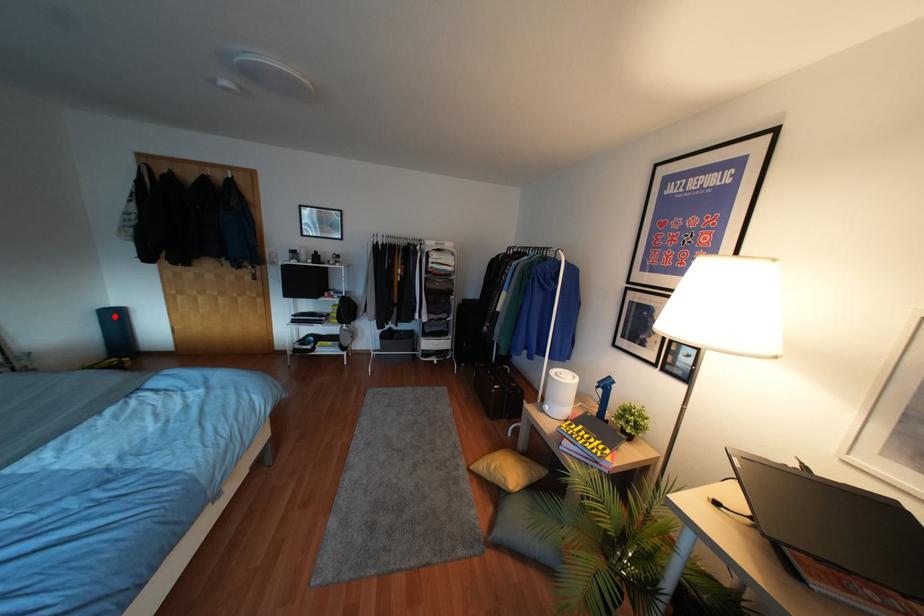
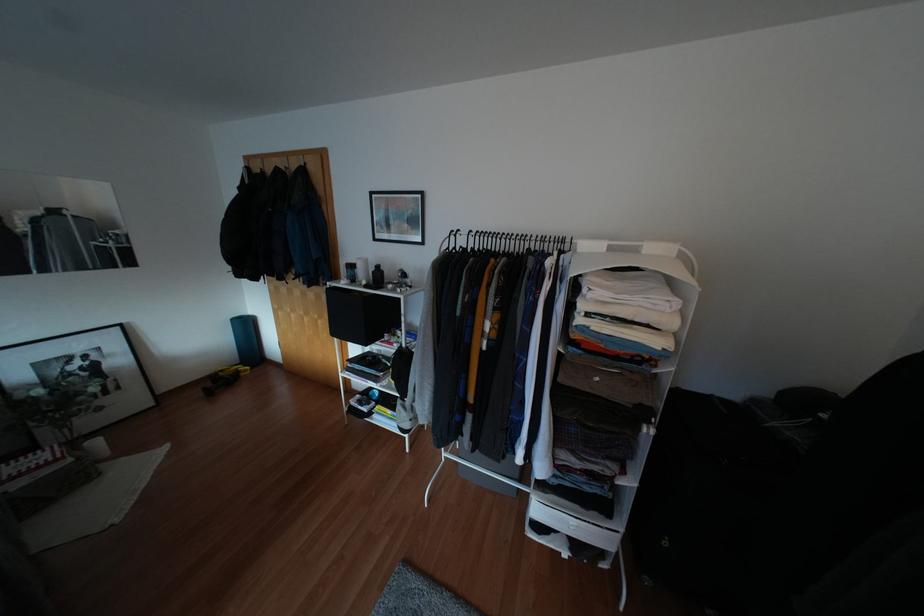
The point at the highlighted location is marked in the first image. Where is the corresponding point in the second image?

(246, 325)